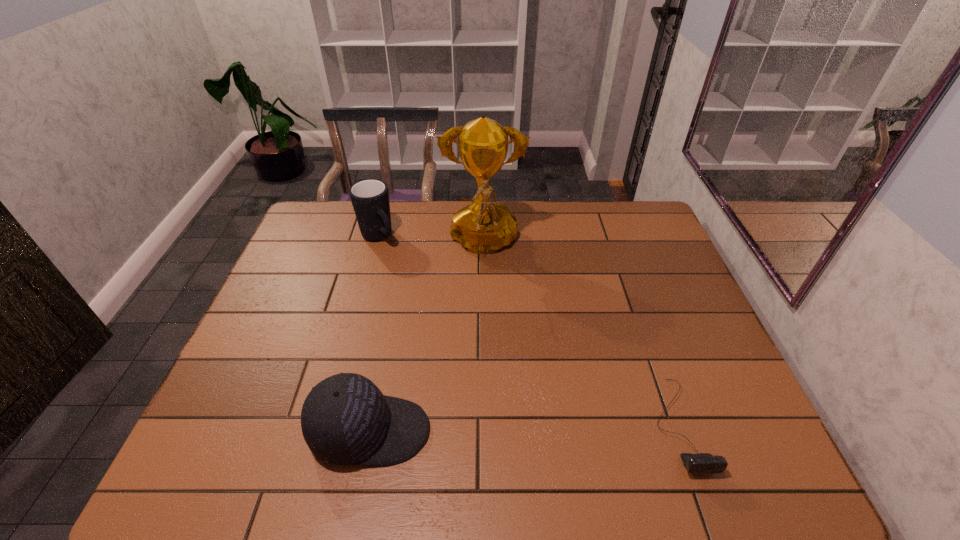
At what (x,y) coordinates should I click in order to perform the action: click on vacant point located between the second shortest object and the rightmost object. Please return your answer as a coordinate pair (x, y). This screenshot has height=540, width=960. Looking at the image, I should click on (524, 428).

The image size is (960, 540). Find the location of `vacant space that is in between the baseball cap and the tallest object`. vacant space that is in between the baseball cap and the tallest object is located at coordinates (426, 338).

Identify the location of free space between the baseball cap and the third shortest object. This screenshot has height=540, width=960. (374, 334).

This screenshot has width=960, height=540. I want to click on object that ranks as the closest to the third shortest object, so click(x=482, y=227).

At what (x,y) coordinates should I click in order to perform the action: click on object that stands as the third closest to the award. Please return your answer as a coordinate pair (x, y). This screenshot has width=960, height=540. Looking at the image, I should click on (704, 463).

Identify the location of blank area in the image that satisfies the following two spatial constraints: 1. on the front side of the mug; 2. at the front of the third tallest object where the brim is located. (324, 431).